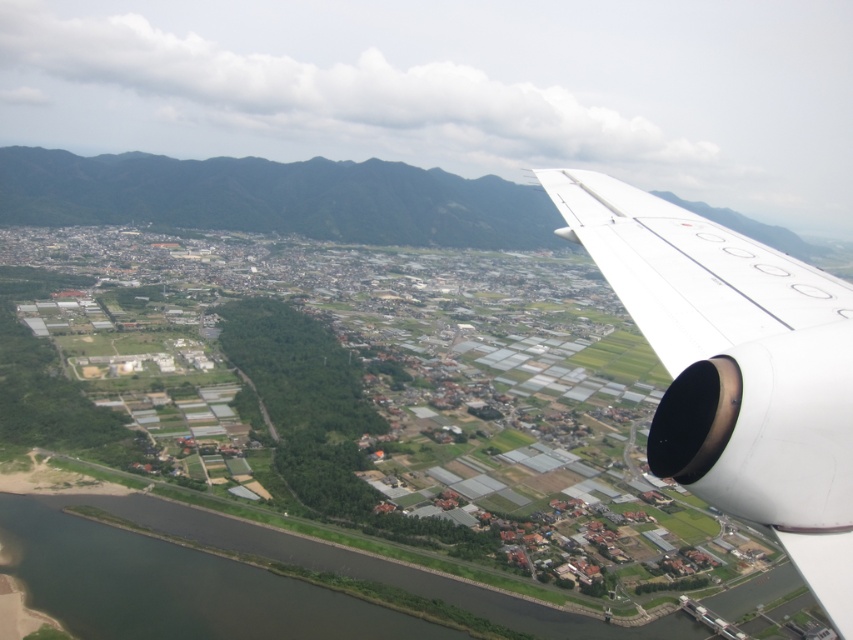
Does white matte airplane wing at right lie behind white matte wing at upper right?

No.

Can you confirm if white matte airplane wing at right is wider than white matte wing at upper right?

Yes, white matte airplane wing at right is wider than white matte wing at upper right.

The height and width of the screenshot is (640, 853). What do you see at coordinates (735, 369) in the screenshot? I see `white matte airplane wing at right` at bounding box center [735, 369].

This screenshot has width=853, height=640. Find the location of `white matte airplane wing at right`. white matte airplane wing at right is located at coordinates (735, 369).